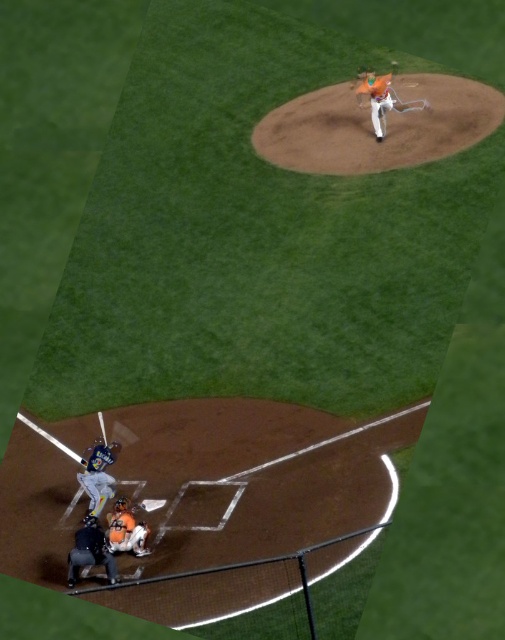
From the picture: Does orange helmeted umpire at lower left come behind gray matte uniform at lower left?

No, it is in front of gray matte uniform at lower left.

Does orange helmeted umpire at lower left have a lesser width compared to gray matte uniform at lower left?

No.

Which is in front, point (73, 563) or point (116, 451)?

Point (73, 563) is more forward.

The height and width of the screenshot is (640, 505). I want to click on orange helmeted umpire at lower left, so click(x=90, y=552).

Does orange helmeted umpire at lower left have a larger size compared to orange matte catcher at lower center?

Correct, orange helmeted umpire at lower left is larger in size than orange matte catcher at lower center.

Can you confirm if orange helmeted umpire at lower left is positioned to the right of orange matte catcher at lower center?

No, orange helmeted umpire at lower left is not to the right of orange matte catcher at lower center.

Does point (90, 552) lie in front of point (126, 515)?

Yes, point (90, 552) is in front of point (126, 515).

At what (x,y) coordinates should I click in order to perform the action: click on orange helmeted umpire at lower left. Please return your answer as a coordinate pair (x, y). This screenshot has height=640, width=505. Looking at the image, I should click on 90,552.

Describe the element at coordinates (126, 531) in the screenshot. The width and height of the screenshot is (505, 640). I see `orange matte catcher at lower center` at that location.

Who is more forward, (107, 538) or (114, 460)?

Point (107, 538) is in front.

Who is more distant from viewer, (136, 524) or (106, 448)?

The point (106, 448) is more distant.

Identify the location of orange matte catcher at lower center. (126, 531).